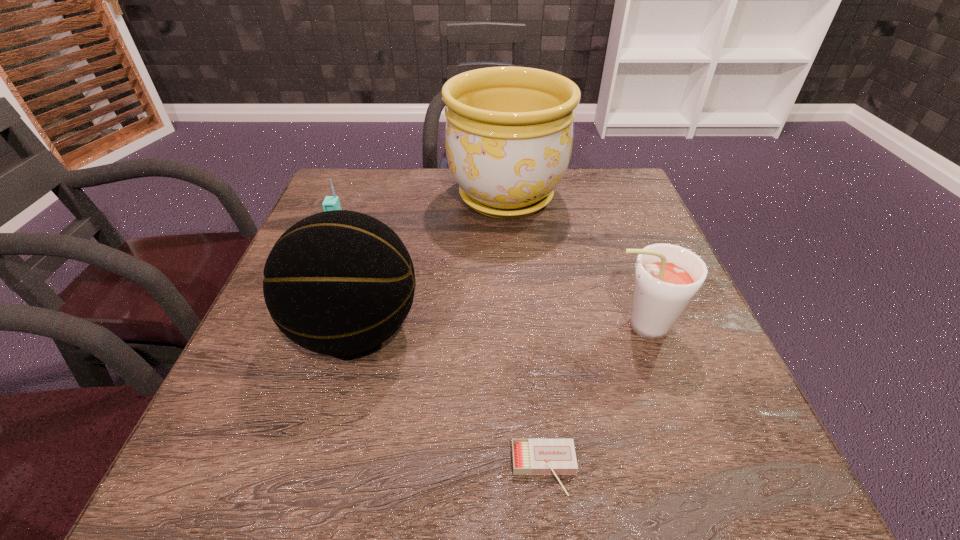
Where is `flowerpot`? flowerpot is located at coordinates (509, 130).

Where is `the fourth shortest object`? This screenshot has height=540, width=960. the fourth shortest object is located at coordinates (338, 283).

You are a GUI agent. You are given a task and a screenshot of the screen. Output one action in this format:
    pyautogui.click(x=<x>, y=<y>)
    Task: Click on the rightmost object
    The width and height of the screenshot is (960, 540).
    Given the screenshot: What is the action you would take?
    (x=667, y=277)

Find the location of `root beer`. root beer is located at coordinates (667, 277).

The height and width of the screenshot is (540, 960). What are the coordinates of `cellular telephone` in the screenshot? It's located at (330, 203).

Where is `the nearest object`? The width and height of the screenshot is (960, 540). the nearest object is located at coordinates (555, 457).

This screenshot has width=960, height=540. What are the coordinates of `matchbox` in the screenshot? It's located at (555, 457).

You are a GUI agent. You are given a task and a screenshot of the screen. Output one action in this format:
    pyautogui.click(x=<x>, y=<y>)
    Task: Click on the vacant space located on the left of the flowerpot
    
    Given the screenshot: What is the action you would take?
    pyautogui.click(x=414, y=197)

The height and width of the screenshot is (540, 960). I want to click on blank space located 0.250m on the right of the basketball, so click(x=551, y=330).

Image resolution: width=960 pixels, height=540 pixels. Identify the location of vacant space positioned on the drink side of the third tallest object. (435, 327).